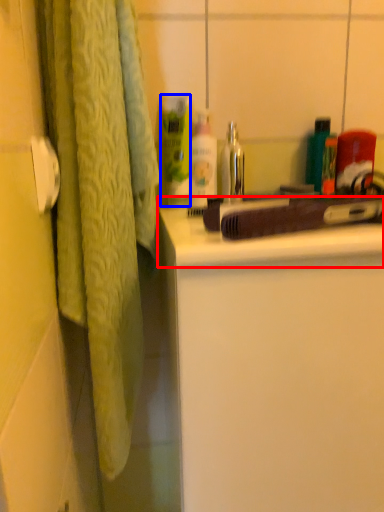
Question: Among these objects, which one is nearest to the camera, counter top (highlighted by a red box) or cleaning product (highlighted by a blue box)?

Choices:
 (A) counter top
 (B) cleaning product

Answer: (A)